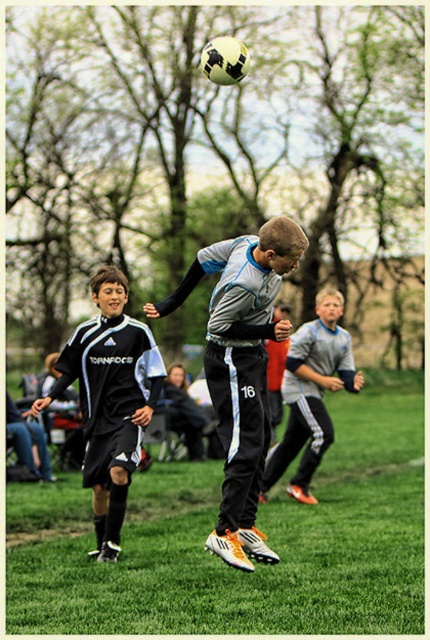
You are standing 20 feet away from the soccer field. If you want to see the point at coordinates point (264, 358) clearly, will you need to move closer or farther away?

The distance of point (264, 358) from viewer is 23.20 feet. Since you are currently 20 feet away, you need to move farther away to be 23.20 feet from the point.

You are a referee observing the soccer match. You need to determine if the black matte soccer player at center can fit between two cones placed where the black adidas soccer uniform at left is located. Can they fit?

The black matte soccer player at center has a lesser width compared to the black adidas soccer uniform at left, so yes, the player can fit between the cones placed at the location of the black adidas soccer uniform at left since they are narrower.